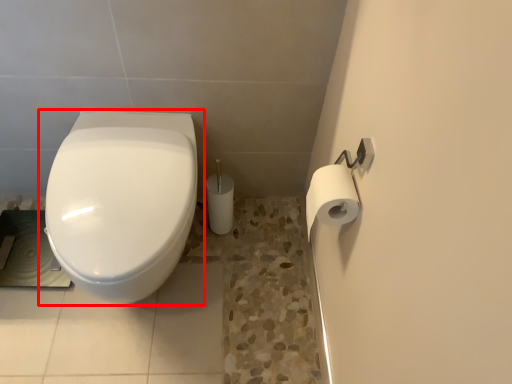
Question: From the image's perspective, what is the correct spatial positioning of toilet (annotated by the red box) in reference to toilet paper?

Choices:
 (A) above
 (B) below

Answer: (B)